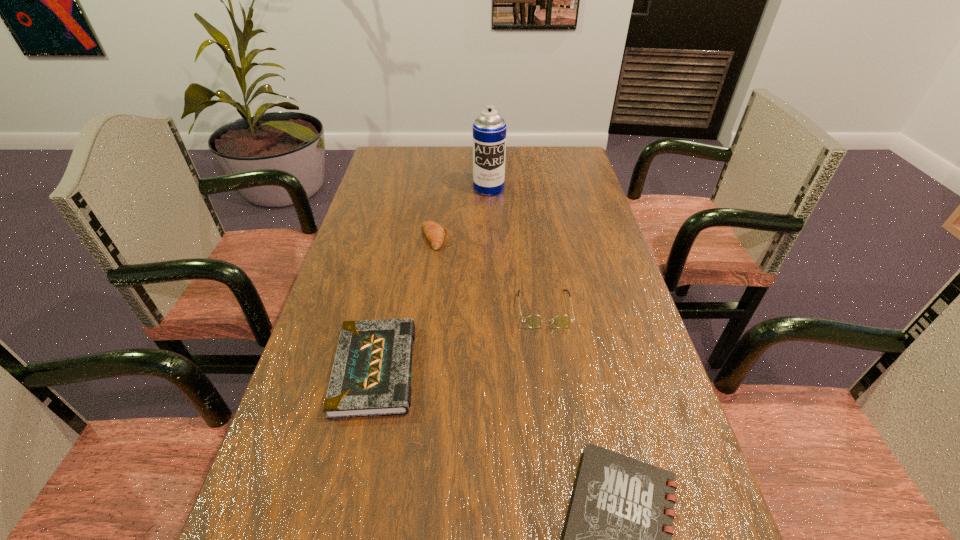
This screenshot has height=540, width=960. What are the coordinates of `object that is positioned at the left edge` in the screenshot? It's located at (371, 376).

I want to click on object present at the right edge, so click(533, 321).

This screenshot has height=540, width=960. I want to click on vacant space at the left edge, so click(395, 258).

At what (x,y) coordinates should I click in order to perform the action: click on vacant area at the right edge of the desktop. Please return your answer as a coordinate pair (x, y). The width and height of the screenshot is (960, 540). Looking at the image, I should click on (598, 402).

This screenshot has width=960, height=540. I want to click on vacant space at the far left corner of the desktop, so click(384, 156).

In the image, there is a desktop. Identify the location of vacant space at the far right corner. The width and height of the screenshot is (960, 540). (550, 147).

Locate an element on the screen. Image resolution: width=960 pixels, height=540 pixels. free point between the spectacles and the taller notebook is located at coordinates (460, 339).

This screenshot has width=960, height=540. Identify the location of vacant region between the third object from left to right and the spectacles. (516, 248).

Find the location of `empty space between the spectacles and the fourth nearest object`. empty space between the spectacles and the fourth nearest object is located at coordinates (490, 273).

Where is `vacant point located between the left notebook and the spectacles`? vacant point located between the left notebook and the spectacles is located at coordinates (460, 339).